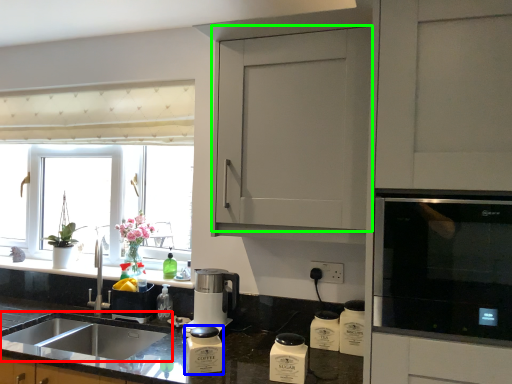
Question: Estimate the real-world distances between objects in this image. Which object is closer to sink (highlighted by a red box), appliance (highlighted by a blue box) or cabinetry (highlighted by a green box)?

Choices:
 (A) appliance
 (B) cabinetry

Answer: (A)